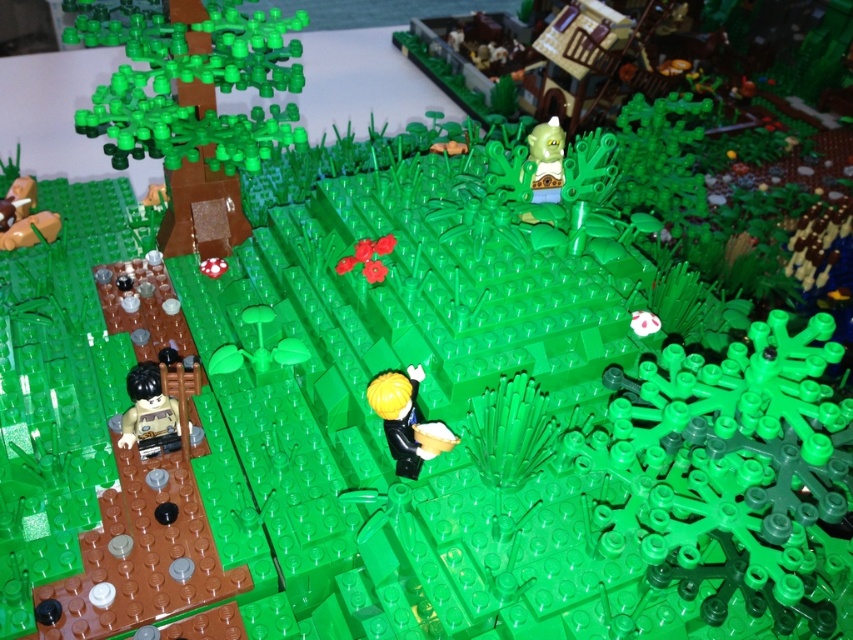
Question: Which point is farther to the camera?

Choices:
 (A) (129, 440)
 (B) (378, 387)
 (C) (212, 218)

Answer: (C)

Question: Is smooth green tree at upper left below black plastic minifigure at center?

Choices:
 (A) no
 (B) yes

Answer: (A)

Question: Which of the following is the closest to the observer?

Choices:
 (A) (167, 237)
 (B) (403, 394)
 (C) (194, 378)

Answer: (B)

Question: Observing the image, what is the correct spatial positioning of brown matte minifigure at lower left in reference to black plastic minifigure at center?

Choices:
 (A) left
 (B) right

Answer: (A)

Question: Which is nearer to the smooth green tree at upper left?

Choices:
 (A) brown matte minifigure at lower left
 (B) black plastic minifigure at center

Answer: (A)

Question: Is smooth green tree at upper left below brown matte minifigure at lower left?

Choices:
 (A) yes
 (B) no

Answer: (B)